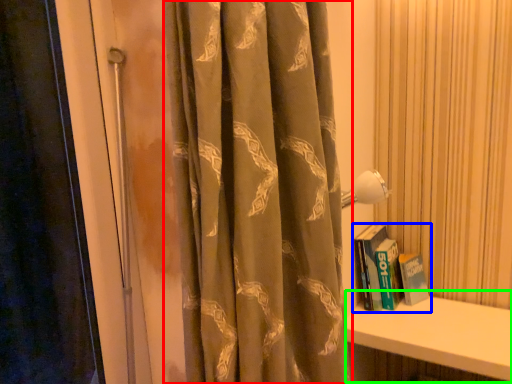
Question: Which is farther away from curtain (highlighted by a red box)? book (highlighted by a blue box) or window sill (highlighted by a green box)?

Choices:
 (A) book
 (B) window sill

Answer: (A)